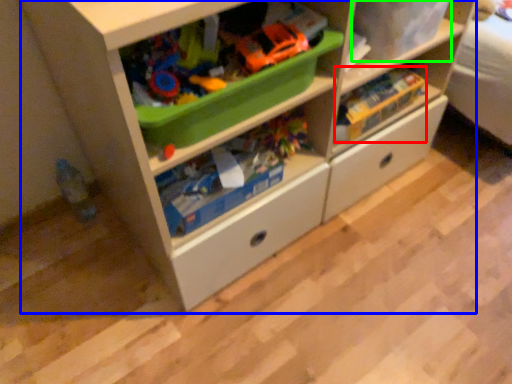
Question: Which object is positioned farthest from toy (highlighted by a red box)? Select from chest of drawers (highlighted by a blue box) and storage box (highlighted by a green box).

Choices:
 (A) chest of drawers
 (B) storage box

Answer: (A)